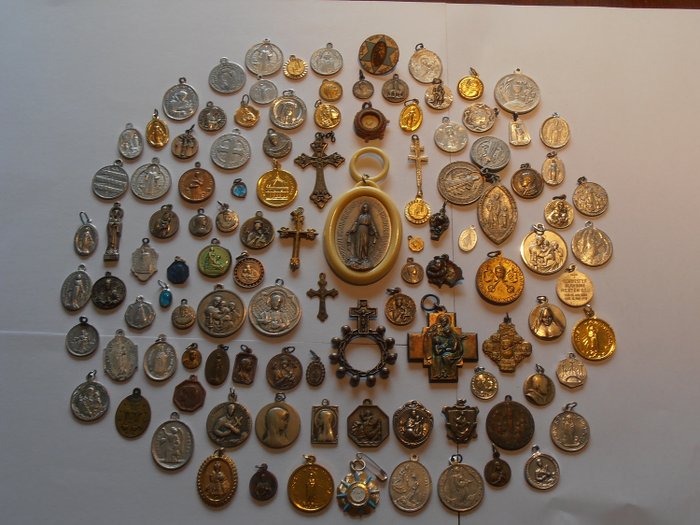
Locate an element on the screen. The width and height of the screenshot is (700, 525). crucifixes is located at coordinates (295, 234), (321, 155), (416, 156), (323, 291), (362, 315), (444, 350).